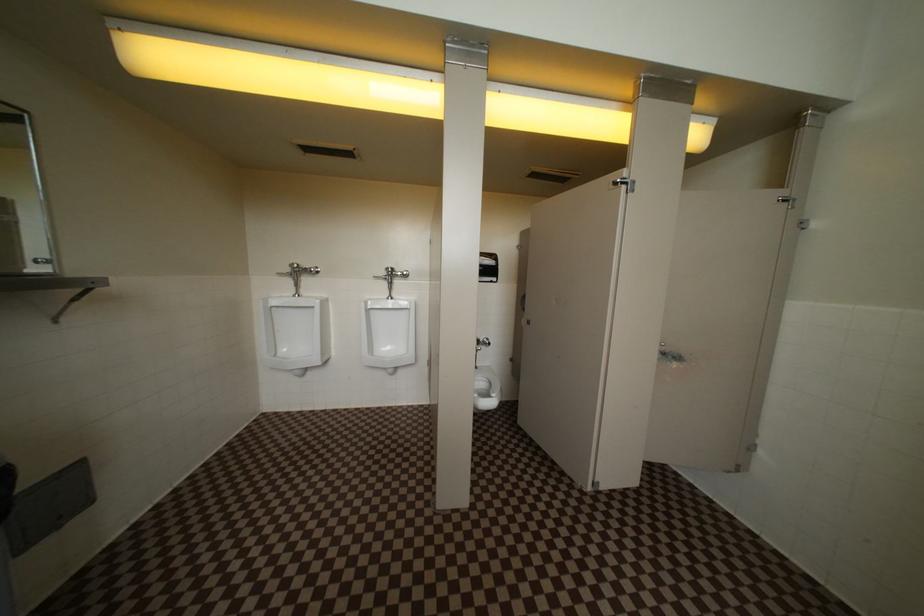
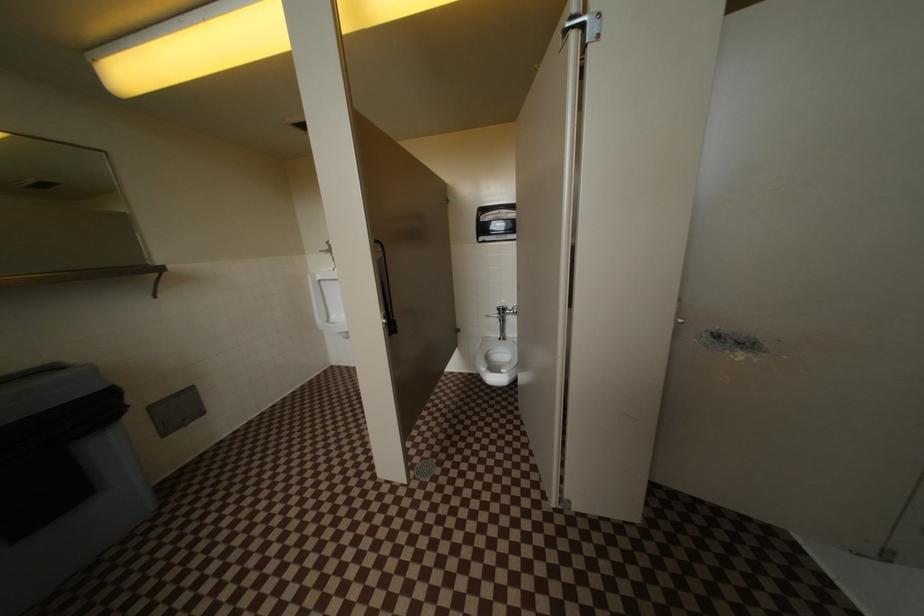
In a continuous first-person perspective shot, in which direction is the camera moving?

The movement direction of the cameraman is right, forward.